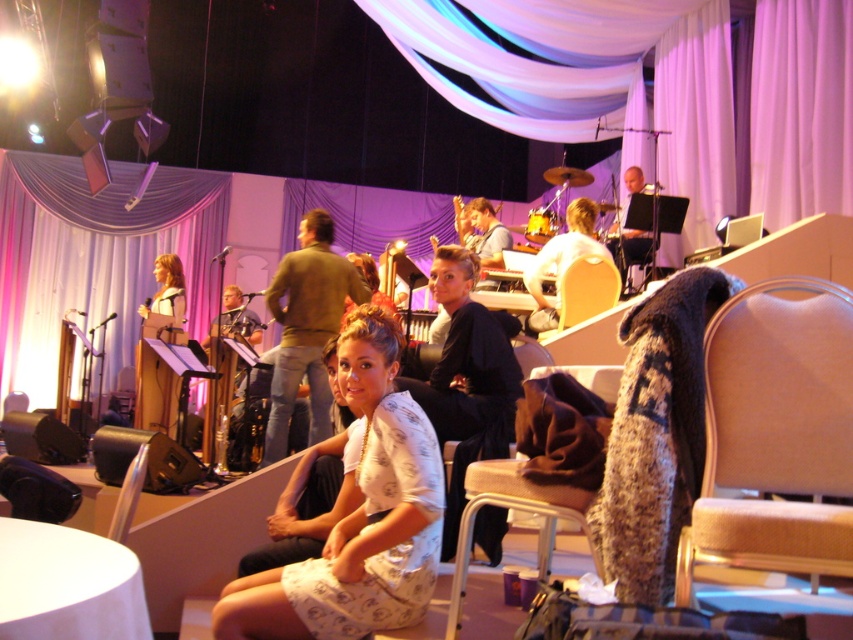
Question: Can you confirm if matte white dress at center is bigger than smooth black drum set at upper right?

Choices:
 (A) no
 (B) yes

Answer: (A)

Question: Among these objects, which one is nearest to the camera?

Choices:
 (A) matte white dress at center
 (B) beige fabric chair at center
 (C) white drapery at upper left

Answer: (B)

Question: Among these objects, which one is farthest from the camera?

Choices:
 (A) brown fabric chair at lower right
 (B) white printed dress at center
 (C) wooden chair at center

Answer: (C)

Question: Is wooden chair at center to the right of matte white dress at center from the viewer's perspective?

Choices:
 (A) no
 (B) yes

Answer: (B)

Question: Which of the following is the closest to the observer?

Choices:
 (A) (490, 355)
 (B) (370, 552)

Answer: (B)

Question: Is white drapery at upper left to the left of matte white dress at center from the viewer's perspective?

Choices:
 (A) no
 (B) yes

Answer: (B)